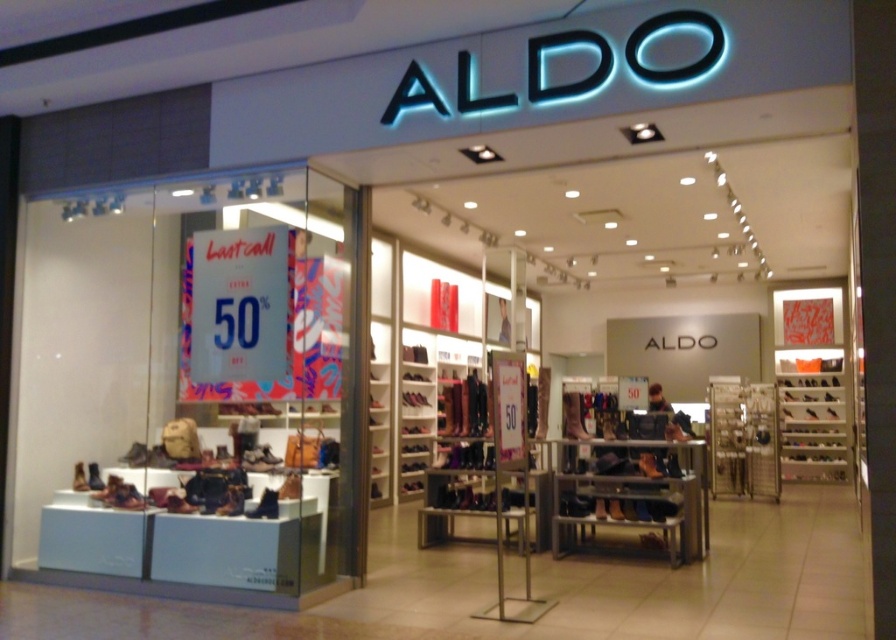
Question: Is matte black shoe at lower center to the left of matte black boot at lower left from the viewer's perspective?

Choices:
 (A) no
 (B) yes

Answer: (A)

Question: Among these points, which one is farthest from the camera?

Choices:
 (A) (166, 502)
 (B) (93, 465)
 (C) (653, 461)
 (D) (266, 486)

Answer: (C)

Question: Where is matte black boot at lower left located in relation to matte brown boot at lower left in the image?

Choices:
 (A) above
 (B) below

Answer: (B)

Question: Which of the following is the closest to the observer?

Choices:
 (A) (169, 488)
 (B) (270, 512)
 (C) (93, 461)
 (D) (80, 488)

Answer: (B)

Question: Is matte black boot at lower left smaller than matte brown boot at lower left?

Choices:
 (A) yes
 (B) no

Answer: (B)

Question: Which of the following is the closest to the observer?

Choices:
 (A) (82, 472)
 (B) (173, 490)

Answer: (B)